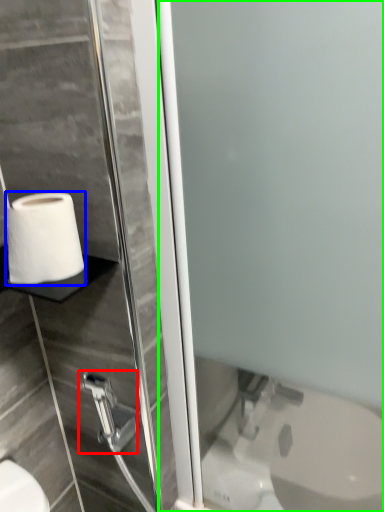
Question: Based on their relative distances, which object is farther from shower (highlighted by a red box)? Choose from toilet paper (highlighted by a blue box) and screen door (highlighted by a green box).

Choices:
 (A) toilet paper
 (B) screen door

Answer: (B)